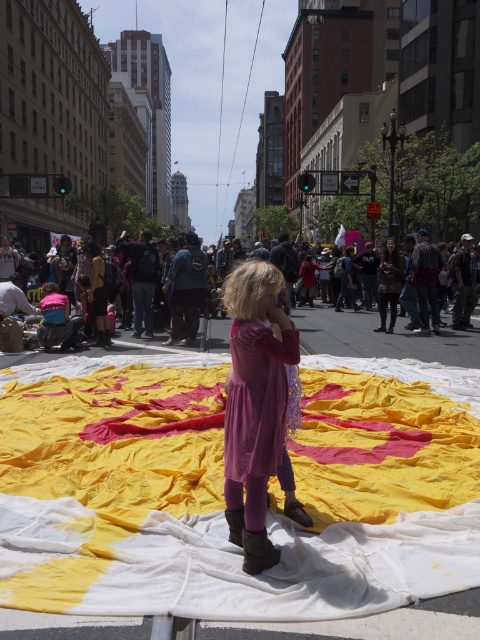
Which is more to the left, yellow fabric at center or velvet purple dress at center?

velvet purple dress at center

Between yellow fabric at center and velvet purple dress at center, which one has more height?

velvet purple dress at center

Does point (195, 566) come behind point (253, 275)?

No, it is in front of (253, 275).

Locate an element on the screen. This screenshot has height=640, width=480. yellow fabric at center is located at coordinates (223, 500).

In the scene shown: Between yellow fabric at center and matte pink dress at center, which one is positioned higher?

matte pink dress at center

Between yellow fabric at center and matte pink dress at center, which one appears on the left side from the viewer's perspective?

Positioned to the left is yellow fabric at center.

In order to click on yellow fabric at center in this screenshot , I will do [223, 500].

Which is behind, point (240, 452) or point (358, 314)?

The point (358, 314) is more distant.

Is the position of velvet purple dress at center less distant than that of matte pink dress at center?

Yes, it is.

What do you see at coordinates (254, 404) in the screenshot?
I see `velvet purple dress at center` at bounding box center [254, 404].

Identify the location of velvet purple dress at center. The image size is (480, 640). (254, 404).